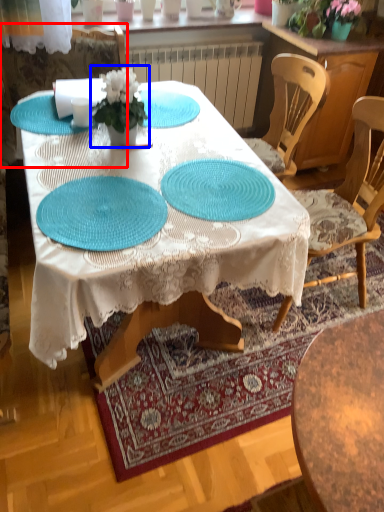
Question: Which of the following is the closest to the observer, chair (highlighted by a red box) or houseplant (highlighted by a blue box)?

Choices:
 (A) chair
 (B) houseplant

Answer: (B)